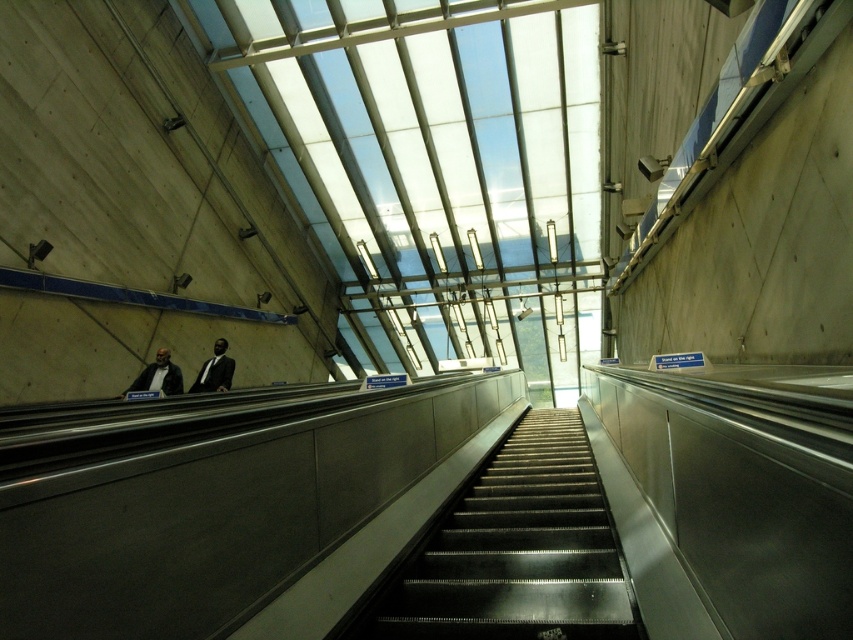
You are standing at the bottom of the escalator and want to reach the top. Is the point at coordinate (515, 552) on the metallic gray stairs at center part of the path you should take?

Yes, the point at coordinate (515, 552) is on the metallic gray stairs at center, which is the path you should take to reach the top of the escalator.

You are standing at the bottom of the escalator and want to reach the person wearing the matte black suit at center. Which direction should you move relative to the metallic gray stairs at center?

You should move upwards relative to the metallic gray stairs at center to reach the person wearing the matte black suit at center since the metallic gray stairs at center is below the matte black suit at center.